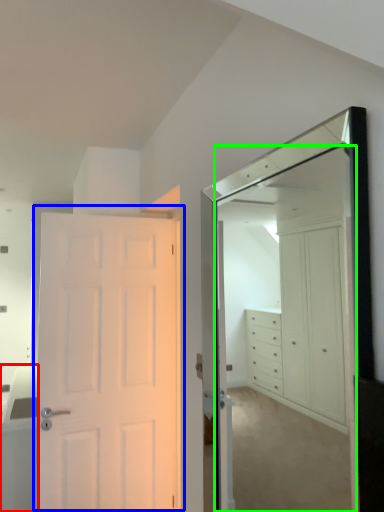
Question: Which is farther away from cabinetry (highlighted by a red box)? door (highlighted by a blue box) or mirror (highlighted by a green box)?

Choices:
 (A) door
 (B) mirror

Answer: (B)